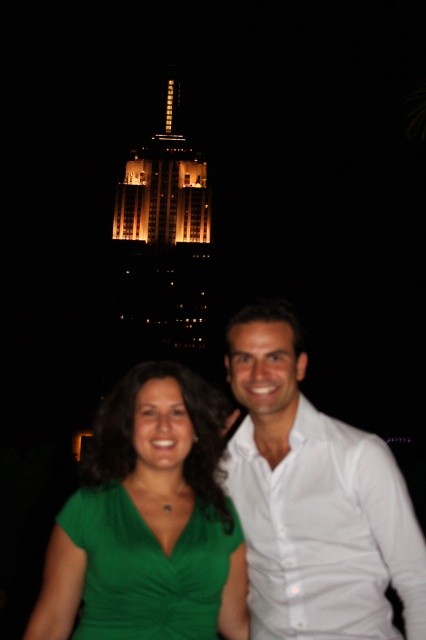
You are standing at the point marked by the coordinates point (411, 532). If you want to walk towards the Empire State Building in the background, which direction should you face?

You should face towards the Empire State Building in the background because the point (411, 532) is located behind the Empire State Building, so walking towards it would require facing away from the building.

You are a photographer who wants to capture a photo of the two people in the scene. Since the Empire State Building is in the background, you want to ensure that the two shirts are clearly visible. Which shirt should you focus on first to ensure it is in focus, given that the white smooth shirt at center is closer to the camera than the green fabric shirt at center?

The white smooth shirt at center is closer to the camera than the green fabric shirt at center, so you should focus on the white smooth shirt at center first to ensure it is in focus.